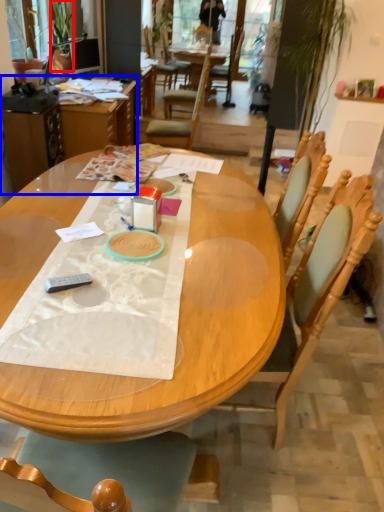
Question: Which point is further to the camera, houseplant (highlighted by a red box) or table (highlighted by a blue box)?

Choices:
 (A) houseplant
 (B) table

Answer: (A)